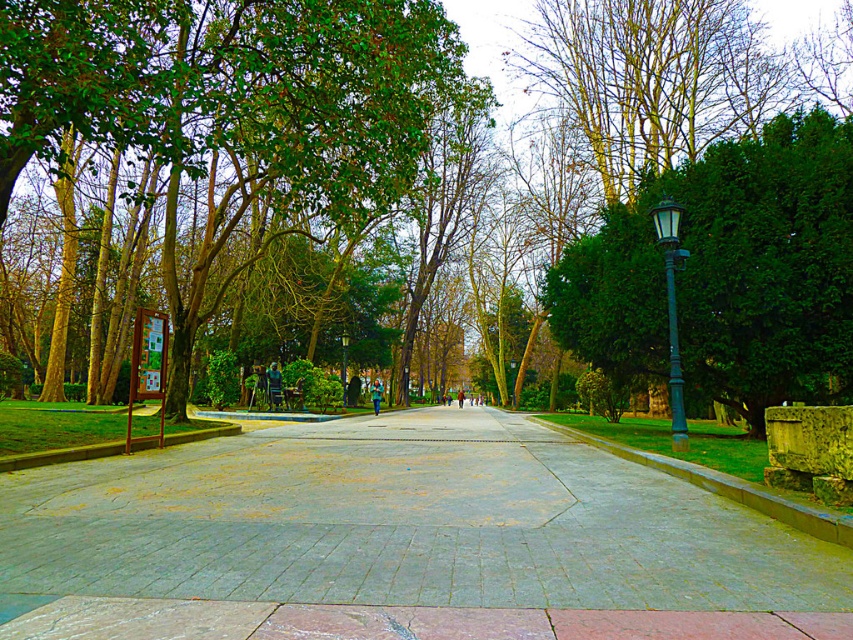
Between green leafy tree at right and green matte lamp post at right, which one has less height?

Standing shorter between the two is green matte lamp post at right.

Is green leafy tree at right closer to camera compared to green matte lamp post at right?

That is False.

Is point (805, 376) farther from camera compared to point (683, 440)?

Yes, it is behind point (683, 440).

I want to click on green leafy tree at right, so pyautogui.click(x=727, y=273).

Is green leafy tree at left to the left of green matte lamp post at right from the viewer's perspective?

Yes, green leafy tree at left is to the left of green matte lamp post at right.

Locate an element on the screen. green leafy tree at left is located at coordinates (230, 112).

Locate an element on the screen. green leafy tree at left is located at coordinates [230, 112].

Does point (511, 570) come in front of point (669, 292)?

Yes.

Is gray concrete pavement at center taller than green matte lamp post at right?

No, gray concrete pavement at center is not taller than green matte lamp post at right.

Is point (163, 586) farther from viewer compared to point (668, 212)?

No, it is not.

At what (x,y) coordinates should I click in order to perform the action: click on gray concrete pavement at center. Please return your answer as a coordinate pair (x, y). Looking at the image, I should click on (399, 541).